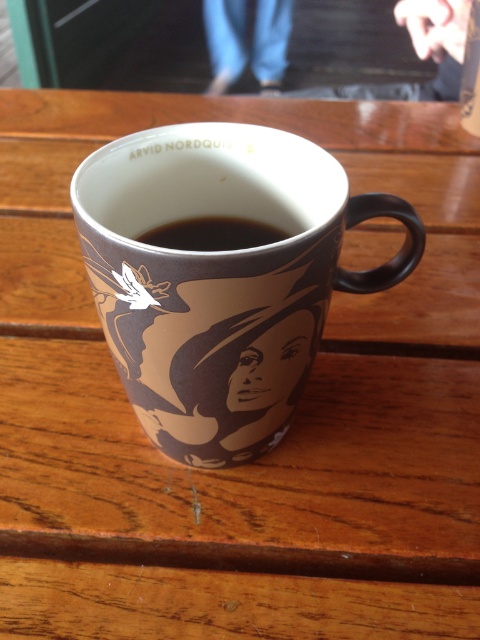
You are a barista preparing a drink and notice the brown matte mug at center and the black glossy coffee at center. Which object is positioned lower on the wooden surface?

The brown matte mug at center is located below the black glossy coffee at center, so it is positioned lower on the wooden surface.